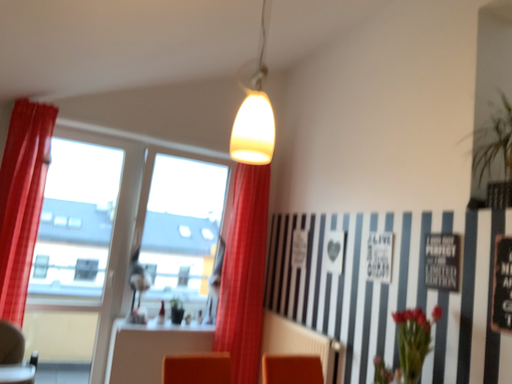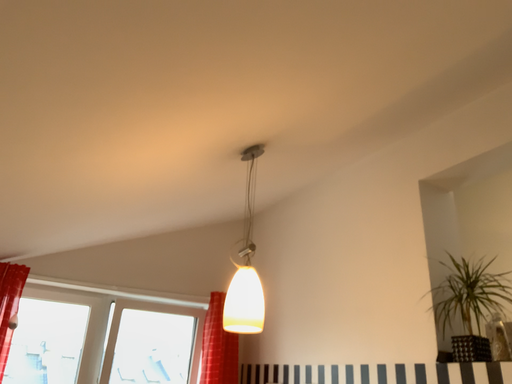
Question: Which way did the camera rotate in the video?

Choices:
 (A) rotated downward
 (B) rotated upward

Answer: (B)